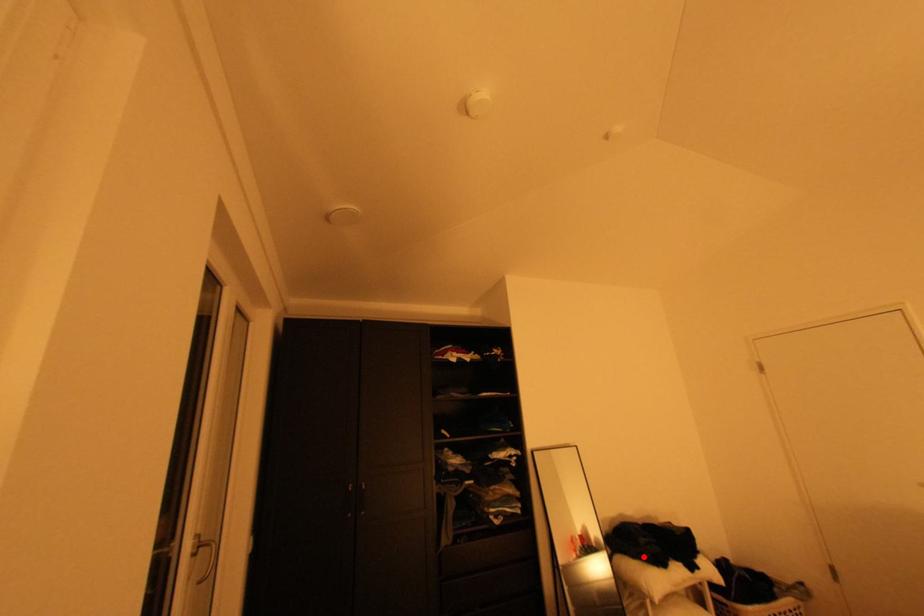
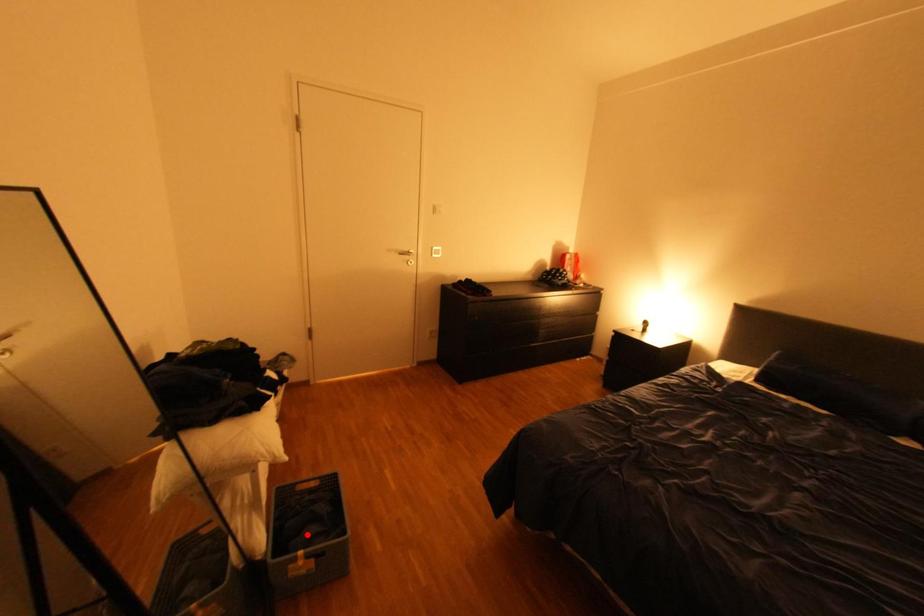
I am providing you with two images of the same scene from different viewpoints. A red point is marked on the first image and another point is marked on the second image. Is the marked point in image1 the same physical position as the marked point in image2?

No